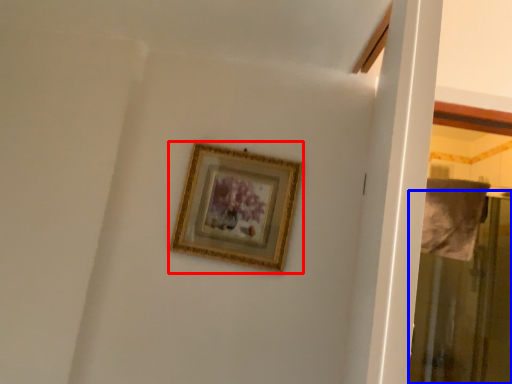
Question: Which object appears closest to the camera in this image, picture frame (highlighted by a red box) or screen door (highlighted by a blue box)?

Choices:
 (A) picture frame
 (B) screen door

Answer: (A)